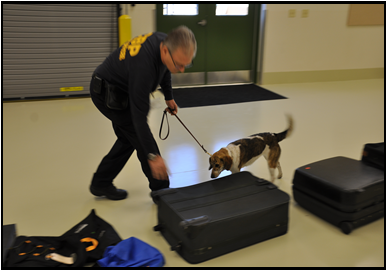
Find the location of a particular element. This screenshot has height=271, width=388. doors is located at coordinates (246, 41).